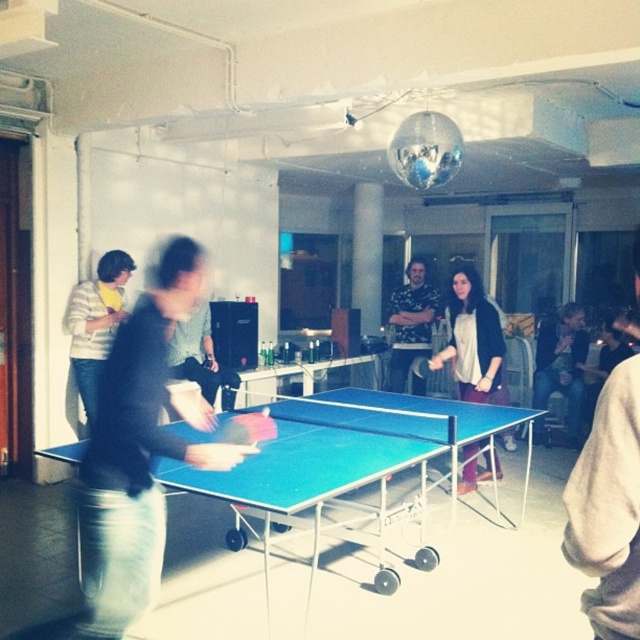
Question: Does matte black shirt at center have a lesser width compared to light brown sweater at right?

Choices:
 (A) no
 (B) yes

Answer: (A)

Question: Which of the following is the farthest from the observer?

Choices:
 (A) (572, 323)
 (B) (92, 364)
 (C) (422, 131)

Answer: (A)

Question: Among these objects, which one is nearest to the camera?

Choices:
 (A) floral-patterned shirt at center
 (B) matte black shirt at center
 (C) blue plastic table at center
 (D) matte black jacket at center

Answer: (B)

Question: Is the position of light brown sweater at right less distant than that of floral-patterned shirt at center?

Choices:
 (A) yes
 (B) no

Answer: (A)

Question: Can you confirm if matte black shirt at center is smaller than matte black jacket at center?

Choices:
 (A) no
 (B) yes

Answer: (A)

Question: Which point is farther from the camera taking this photo?

Choices:
 (A) (412, 152)
 (B) (458, 301)
 (C) (417, 385)

Answer: (C)